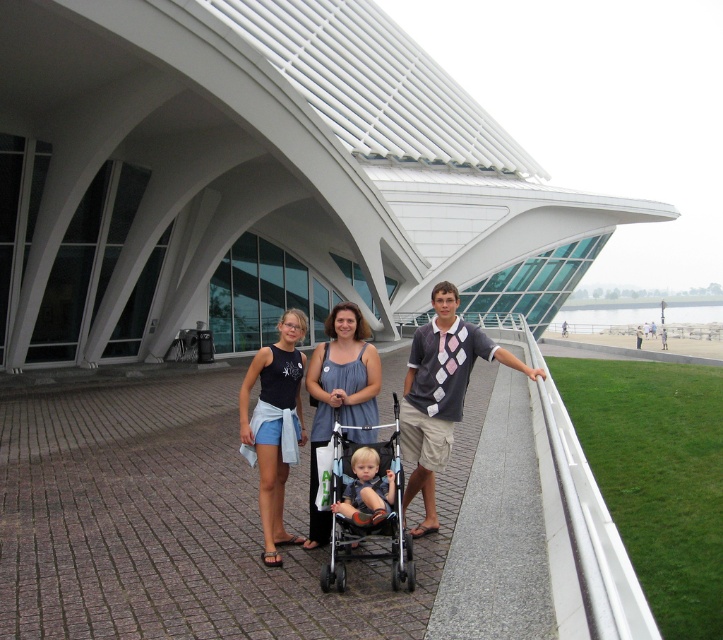
Question: Can you confirm if black metal baby carriage at center is positioned to the right of light brown fabric stroller at center?

Choices:
 (A) yes
 (B) no

Answer: (B)

Question: Estimate the real-world distances between objects in this image. Which object is closer to the black metal baby carriage at center?

Choices:
 (A) denim blue tank top at center
 (B) argyle-patterned shirt at center

Answer: (A)

Question: Which point is closer to the camera?

Choices:
 (A) (341, 330)
 (B) (385, 472)
 (C) (406, 588)
 (D) (244, 388)

Answer: (C)

Question: Is matte gray stroller at center above black fabric tank top at center?

Choices:
 (A) yes
 (B) no

Answer: (B)

Question: Which point is closer to the camera?

Choices:
 (A) black metal baby carriage at center
 (B) black fabric tank top at center
 (C) argyle-patterned shirt at center

Answer: (A)

Question: Observing the image, what is the correct spatial positioning of denim blue tank top at center in reference to light brown fabric stroller at center?

Choices:
 (A) left
 (B) right

Answer: (A)